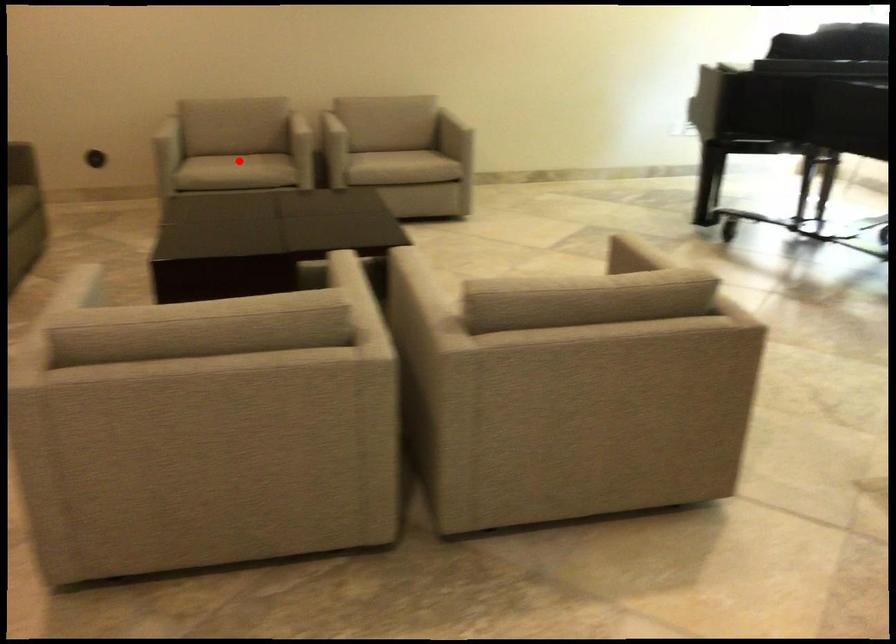
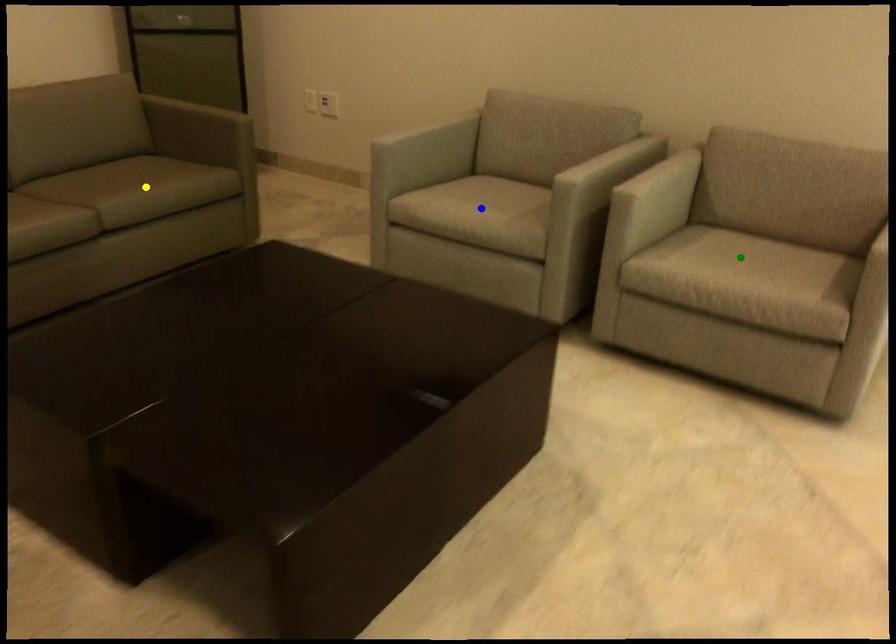
Question: I am providing you with two images of the same scene from different viewpoints. A red point is marked on the first image. You are given multiple points on the second image. Which point in image 2 represents the same 3d spot as the red point in image 1?

Choices:
 (A) blue point
 (B) yellow point
 (C) green point

Answer: (A)